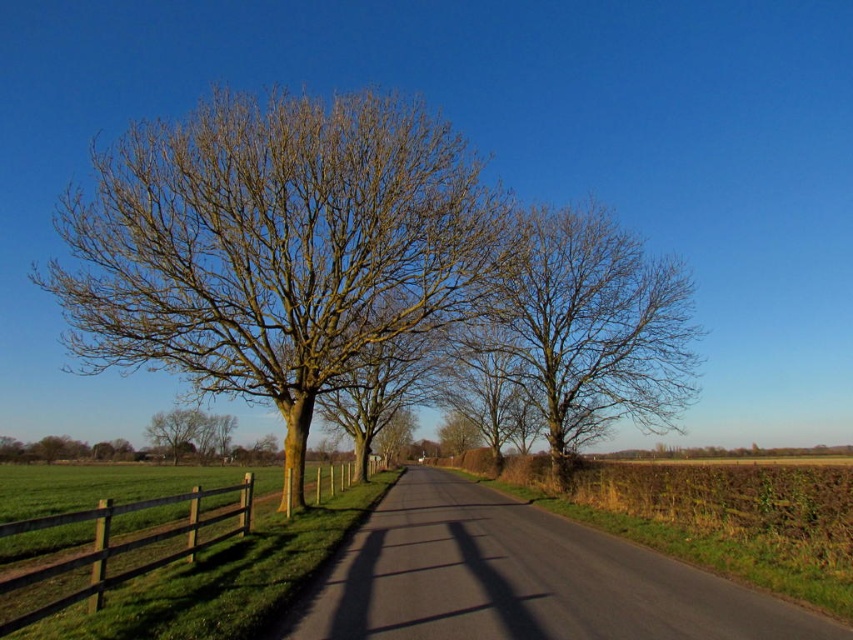
You are a hiker standing at the lower left corner of the image. You want to take a photo of the green mossy tree at center without any obstructions. Since the brown wooden fence at lower left is in your line of sight, can you move to the right to get a clear view?

The green mossy tree at center is taller than the brown wooden fence at lower left, so moving to the right might allow you to see above the fence for an unobstructed view of the tree.

You are standing on the paved road in the image and want to walk towards the green mossy tree at center and the brown rough bark tree at center. Which tree should you walk towards if you want to go to the left side of the road?

You should walk towards the green mossy tree at center because it is located to the left of the brown rough bark tree at center, so it is on the left side of the road.